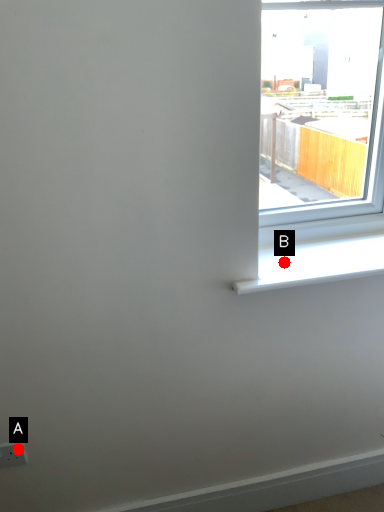
Question: Two points are circled on the image, labeled by A and B beside each circle. Which point is farther from the camera taking this photo?

Choices:
 (A) A is further
 (B) B is further

Answer: (B)